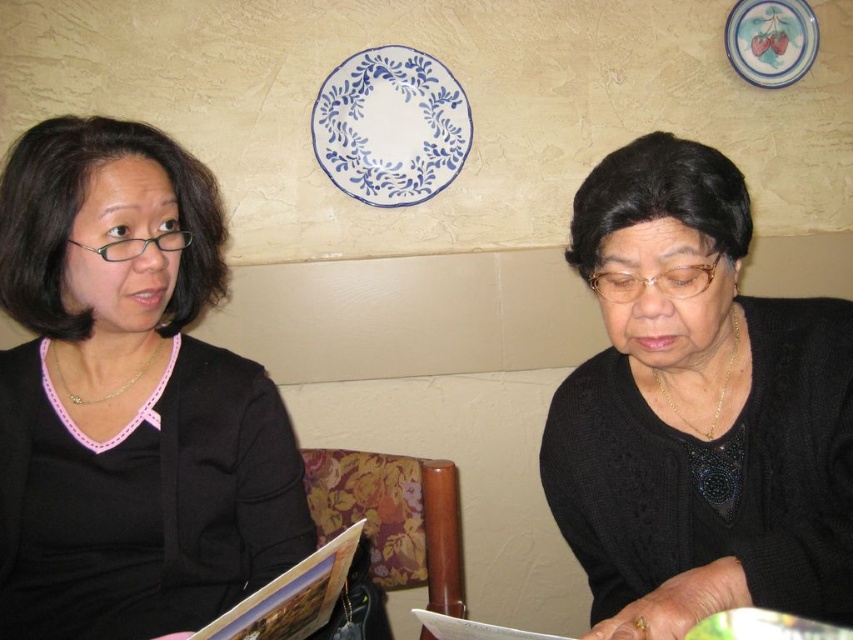
Question: Is black matte sweater at upper left closer to camera compared to black matte sweater at lower right?

Choices:
 (A) yes
 (B) no

Answer: (B)

Question: Which object appears closest to the camera in this image?

Choices:
 (A) black matte sweater at upper left
 (B) black matte sweater at lower right

Answer: (B)

Question: Which point is closer to the camera taking this photo?

Choices:
 (A) (175, 570)
 (B) (730, 564)

Answer: (B)

Question: Is black matte sweater at upper left behind black matte sweater at lower right?

Choices:
 (A) yes
 (B) no

Answer: (A)

Question: In this image, where is black matte sweater at upper left located relative to black matte sweater at lower right?

Choices:
 (A) left
 (B) right

Answer: (A)